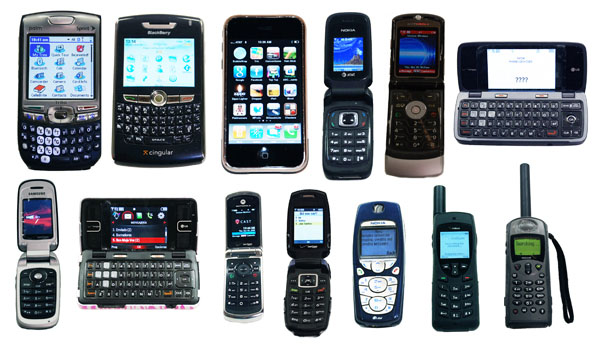
The image size is (600, 345). I want to click on keyboard, so click(63, 134), click(149, 122), click(523, 124), click(136, 273).